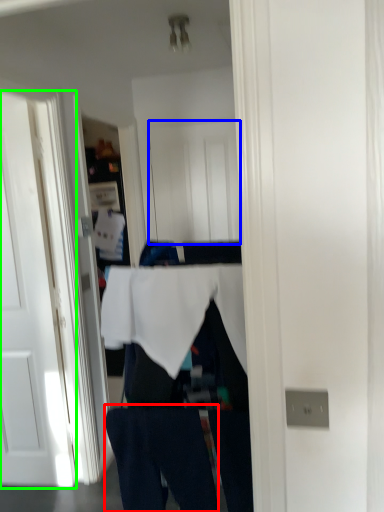
Question: Which is farther away from jeans (highlighted by a red box)? door (highlighted by a blue box) or door (highlighted by a green box)?

Choices:
 (A) door
 (B) door

Answer: (A)